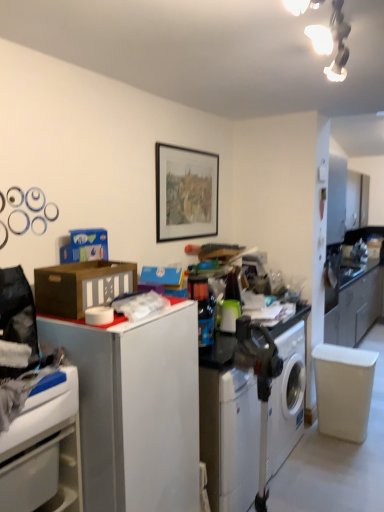
Question: Is white plastic washing machine at lower center thinner than matte black picture frame at center?

Choices:
 (A) no
 (B) yes

Answer: (A)

Question: From the image's perspective, is white plastic washing machine at lower center located beneath matte black picture frame at center?

Choices:
 (A) no
 (B) yes

Answer: (B)

Question: Does white plastic washing machine at lower center have a greater height compared to matte black picture frame at center?

Choices:
 (A) yes
 (B) no

Answer: (A)

Question: Does white plastic washing machine at lower center have a greater width compared to matte black picture frame at center?

Choices:
 (A) yes
 (B) no

Answer: (A)

Question: Can you confirm if white plastic washing machine at lower center is shorter than matte black picture frame at center?

Choices:
 (A) yes
 (B) no

Answer: (B)

Question: Is white glossy cabinet at lower left spatially inside matte black picture frame at center, or outside of it?

Choices:
 (A) inside
 (B) outside

Answer: (B)

Question: Is white glossy cabinet at lower left taller or shorter than matte black picture frame at center?

Choices:
 (A) tall
 (B) short

Answer: (B)

Question: Is point (46, 463) closer or farther from the camera than point (198, 202)?

Choices:
 (A) closer
 (B) farther

Answer: (A)

Question: Visually, is white glossy cabinet at lower left positioned to the left or to the right of matte black picture frame at center?

Choices:
 (A) left
 (B) right

Answer: (A)

Question: Considering the positions of point (77, 452) and point (304, 352), is point (77, 452) closer or farther from the camera than point (304, 352)?

Choices:
 (A) closer
 (B) farther

Answer: (A)

Question: Choose the correct answer: Is white glossy cabinet at lower left inside white plastic washing machine at lower center or outside it?

Choices:
 (A) outside
 (B) inside

Answer: (A)

Question: In terms of height, does white glossy cabinet at lower left look taller or shorter compared to white plastic washing machine at lower center?

Choices:
 (A) short
 (B) tall

Answer: (A)

Question: Relative to white plastic washing machine at lower center, is white glossy cabinet at lower left in front or behind?

Choices:
 (A) front
 (B) behind

Answer: (A)

Question: Is point (168, 145) closer or farther from the camera than point (178, 372)?

Choices:
 (A) farther
 (B) closer

Answer: (A)

Question: Is matte black picture frame at center inside the boundaries of white matte file cabinet at left, or outside?

Choices:
 (A) outside
 (B) inside

Answer: (A)